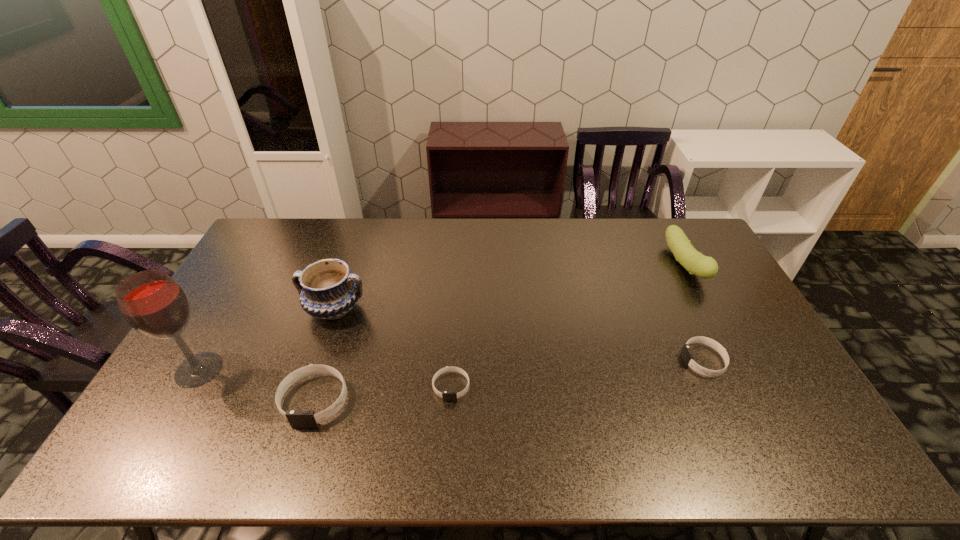
Identify the location of blank space located on the outer surface of the shortest wristband. (449, 422).

This screenshot has height=540, width=960. I want to click on vacant space located 0.350m on the outer surface of the fifth tallest object, so click(561, 361).

Find the location of a particular element. free space located 0.340m on the outer surface of the fifth tallest object is located at coordinates (564, 361).

Identify the location of vacant space located on the outer surface of the fifth tallest object. This screenshot has height=540, width=960. click(x=620, y=361).

Locate an element on the screen. This screenshot has width=960, height=540. vacant space located 0.390m on the right of the alcohol is located at coordinates tap(362, 369).

This screenshot has width=960, height=540. In order to click on vacant space located on the back of the third tallest object in this screenshot , I will do `click(664, 225)`.

This screenshot has width=960, height=540. I want to click on free space located on the right of the second tallest object, so click(x=424, y=309).

What are the coordinates of `object that is at the far edge` in the screenshot? It's located at (696, 263).

Locate an element on the screen. The width and height of the screenshot is (960, 540). object that is at the left edge is located at coordinates (154, 304).

Locate an element on the screen. The image size is (960, 540). wristband at the right edge is located at coordinates (687, 356).